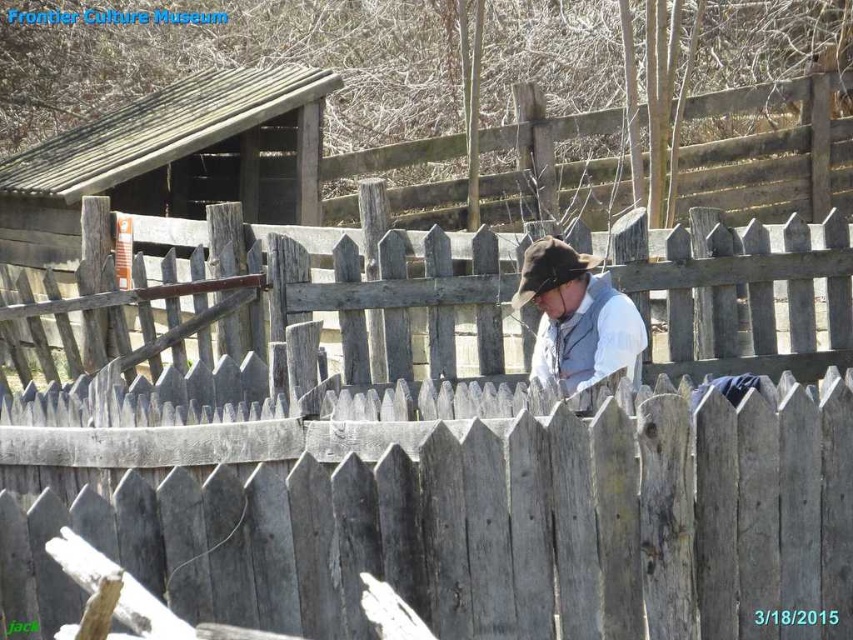
Can you confirm if white cotton shirt at center is smaller than brown felt cowboy hat at center?

No, white cotton shirt at center is not smaller than brown felt cowboy hat at center.

Can you confirm if white cotton shirt at center is positioned above brown felt cowboy hat at center?

No, white cotton shirt at center is not above brown felt cowboy hat at center.

The width and height of the screenshot is (853, 640). What do you see at coordinates (577, 317) in the screenshot?
I see `white cotton shirt at center` at bounding box center [577, 317].

Where is `white cotton shirt at center`? white cotton shirt at center is located at coordinates (577, 317).